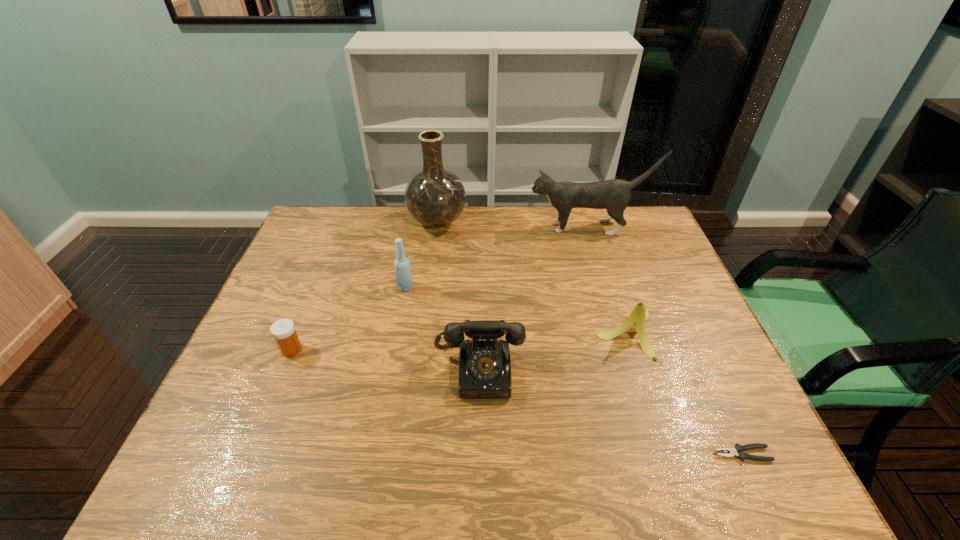
In order to click on vacant space that satisfies the following two spatial constraints: 1. on the back side of the leftmost object; 2. on the left side of the banana in this screenshot , I will do `click(299, 333)`.

I want to click on free spot that satisfies the following two spatial constraints: 1. at the face of the cat; 2. on the dial of the telephone, so click(633, 370).